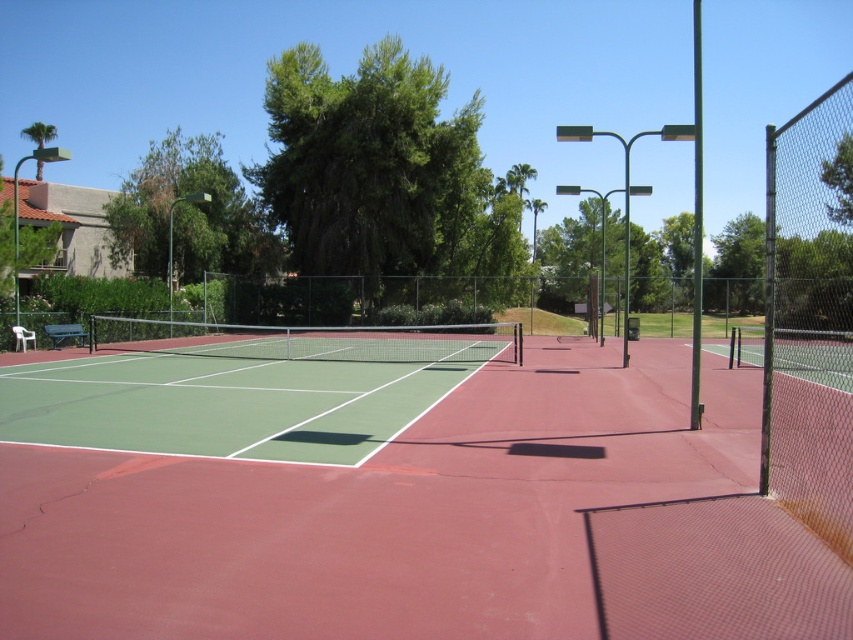
Who is positioned more to the left, green leafy tree at upper center or green leafy tree at upper right?

green leafy tree at upper right is more to the left.

Is green leafy tree at upper center taller than green leafy tree at upper right?

Yes, green leafy tree at upper center is taller than green leafy tree at upper right.

Who is more distant from viewer, [566,268] or [838,172]?

Positioned behind is point [566,268].

The height and width of the screenshot is (640, 853). Find the location of `green leafy tree at upper center`. green leafy tree at upper center is located at coordinates (584, 241).

Where is `green rubber tennis court at center`? The height and width of the screenshot is (640, 853). green rubber tennis court at center is located at coordinates (434, 524).

Does point (808, 536) lie behind point (558, 268)?

No, it is not.

Identify the location of green rubber tennis court at center. (434, 524).

Is green rubber tennis court at center shorter than green leafy tree at upper left?

Yes.

Can you confirm if green rubber tennis court at center is positioned to the right of green leafy tree at upper left?

Yes, green rubber tennis court at center is to the right of green leafy tree at upper left.

The width and height of the screenshot is (853, 640). What are the coordinates of `green rubber tennis court at center` in the screenshot? It's located at (434, 524).